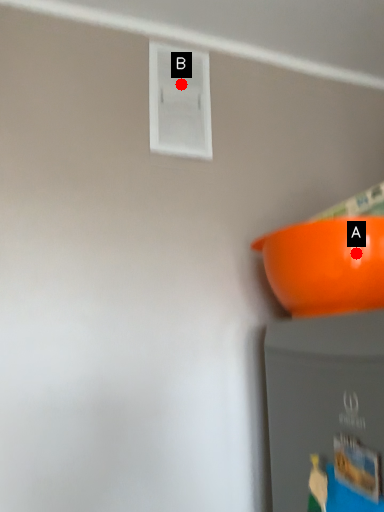
Question: Two points are circled on the image, labeled by A and B beside each circle. Which point appears farthest from the camera in this image?

Choices:
 (A) A is further
 (B) B is further

Answer: (B)